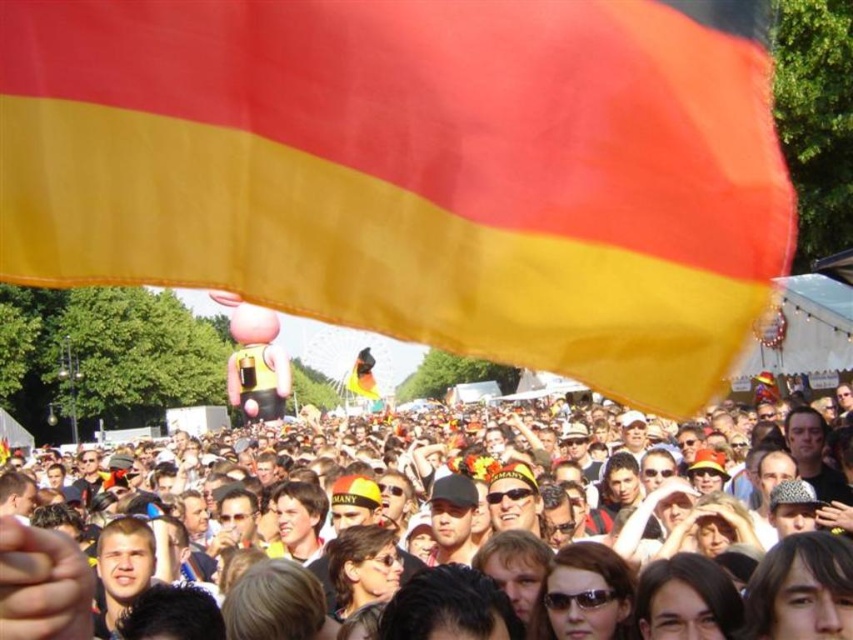
Is matte fabric flag at upper center positioned at the back of matte yellow flag at upper center?

Yes.

In the scene shown: Who is more distant from viewer, [96,200] or [86,588]?

The point [96,200] is behind.

Image resolution: width=853 pixels, height=640 pixels. Find the location of `matte fabric flag at upper center`. matte fabric flag at upper center is located at coordinates (415, 170).